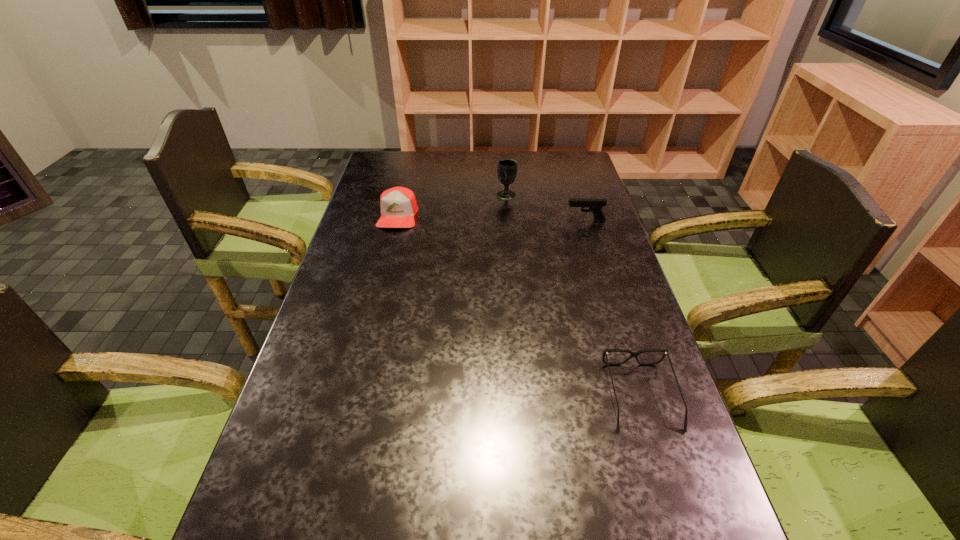
Locate an element on the screen. the farthest object is located at coordinates (507, 168).

Where is `the third object from right to left`? the third object from right to left is located at coordinates (507, 168).

Where is `pistol`? The image size is (960, 540). pistol is located at coordinates (595, 205).

Identify the location of the leftmost object. This screenshot has height=540, width=960. (398, 206).

In order to click on the nearest object in this screenshot , I will do `click(633, 354)`.

I want to click on spectacles, so click(x=633, y=354).

You are a GUI agent. You are given a task and a screenshot of the screen. Output one action in this format:
    pyautogui.click(x=<x>, y=<y>)
    Task: Click on the vacant region located 0.050m on the right of the tallest object
    
    Given the screenshot: What is the action you would take?
    pyautogui.click(x=530, y=195)

The height and width of the screenshot is (540, 960). I want to click on vacant area situated 0.250m on the front-facing side of the pistol, so click(x=492, y=221).

This screenshot has height=540, width=960. What are the coordinates of `vacant area located on the front-facing side of the pistol` in the screenshot? It's located at (539, 221).

Where is `free space located on the front-facing side of the pistol`? The image size is (960, 540). free space located on the front-facing side of the pistol is located at coordinates (545, 221).